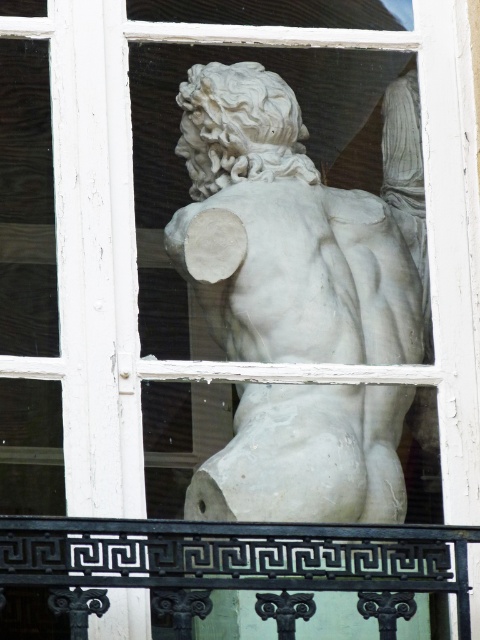
How much distance is there between white marble torso at center and black wrought iron at lower center?

36.11 feet

Which is more to the right, white marble torso at center or black wrought iron at lower center?

From the viewer's perspective, white marble torso at center appears more on the right side.

Image resolution: width=480 pixels, height=640 pixels. What do you see at coordinates (298, 227) in the screenshot?
I see `white marble torso at center` at bounding box center [298, 227].

Identify the location of white marble torso at center. pyautogui.click(x=298, y=227).